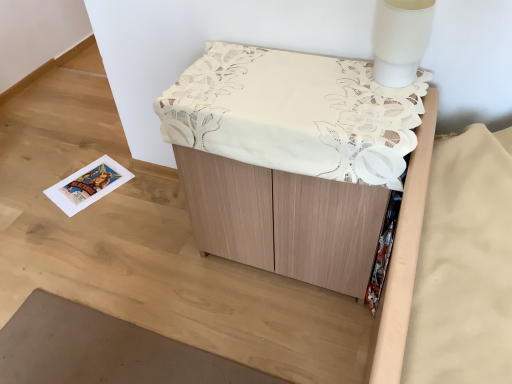
You are a GUI agent. You are given a task and a screenshot of the screen. Output one action in this format:
    pyautogui.click(x=<x>, y=<y>)
    Task: Click on the free location to the left of white matte table lamp at upper right
    
    Given the screenshot: What is the action you would take?
    pyautogui.click(x=325, y=83)